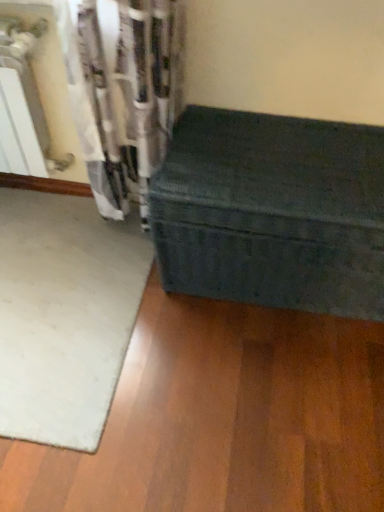
Question: Based on their sizes in the image, would you say green fabric trunk at lower right is bigger or smaller than white soft mat at lower left?

Choices:
 (A) big
 (B) small

Answer: (A)

Question: From a real-world perspective, relative to white soft mat at lower left, is green fabric trunk at lower right vertically above or below?

Choices:
 (A) above
 (B) below

Answer: (A)

Question: Is green fabric trunk at lower right to the left or to the right of white soft mat at lower left in the image?

Choices:
 (A) left
 (B) right

Answer: (B)

Question: Considering the positions of white soft mat at lower left and green fabric trunk at lower right in the image, is white soft mat at lower left taller or shorter than green fabric trunk at lower right?

Choices:
 (A) short
 (B) tall

Answer: (A)

Question: Considering the positions of white soft mat at lower left and green fabric trunk at lower right in the image, is white soft mat at lower left bigger or smaller than green fabric trunk at lower right?

Choices:
 (A) small
 (B) big

Answer: (A)

Question: In the image, is white soft mat at lower left on the left side or the right side of green fabric trunk at lower right?

Choices:
 (A) right
 (B) left

Answer: (B)

Question: Relative to green fabric trunk at lower right, is white soft mat at lower left in front or behind?

Choices:
 (A) behind
 (B) front

Answer: (A)